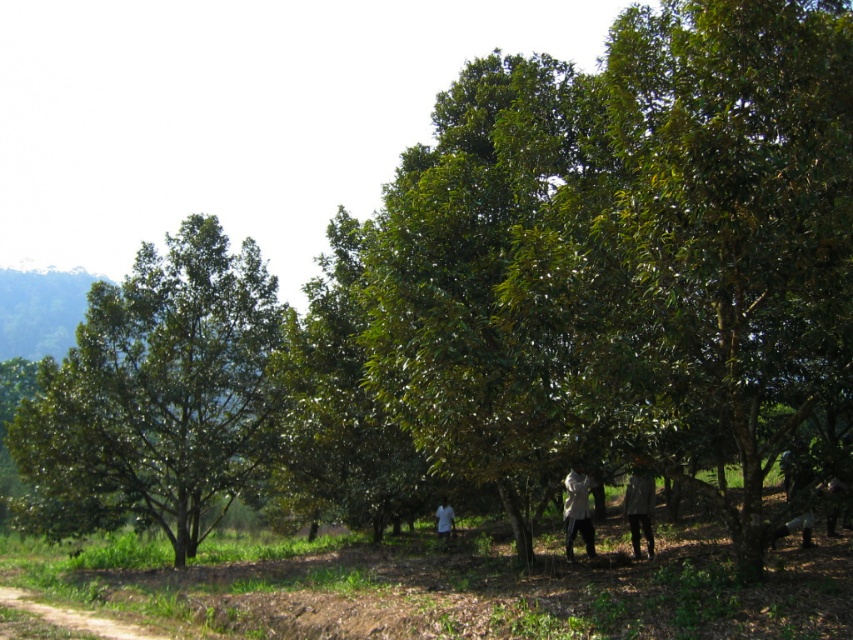
Question: Among these objects, which one is nearest to the camera?

Choices:
 (A) white fabric shirt at center
 (B) white fabric coat at center
 (C) dark gray coat at center
 (D) green leafy tree at left

Answer: (B)

Question: Which point is farther to the camera?

Choices:
 (A) (573, 497)
 (B) (445, 500)
 (C) (35, 442)

Answer: (B)

Question: Which point is closer to the camera taking this photo?

Choices:
 (A) (630, 486)
 (B) (442, 499)
 (C) (225, 420)

Answer: (A)

Question: Is dark gray coat at center further to the viewer compared to white fabric shirt at center?

Choices:
 (A) yes
 (B) no

Answer: (B)

Question: Observing the image, what is the correct spatial positioning of green leafy tree at left in reference to white fabric coat at center?

Choices:
 (A) right
 (B) left

Answer: (B)

Question: Observing the image, what is the correct spatial positioning of dark gray coat at center in reference to white fabric coat at center?

Choices:
 (A) left
 (B) right

Answer: (B)